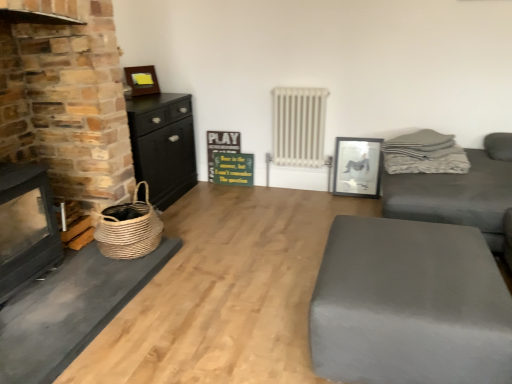
Question: Can we say white metallic radiator at center lies outside gray fabric couch at right?

Choices:
 (A) no
 (B) yes

Answer: (B)

Question: Can you confirm if white metallic radiator at center is taller than gray fabric couch at right?

Choices:
 (A) yes
 (B) no

Answer: (B)

Question: Is white metallic radiator at center shorter than gray fabric couch at right?

Choices:
 (A) no
 (B) yes

Answer: (B)

Question: Would you consider white metallic radiator at center to be distant from gray fabric couch at right?

Choices:
 (A) yes
 (B) no

Answer: (A)

Question: Does white metallic radiator at center have a larger size compared to gray fabric couch at right?

Choices:
 (A) no
 (B) yes

Answer: (A)

Question: Choose the correct answer: Is black glossy picture frame at upper right, the second picture frame from the left, inside green wooden signboard at center or outside it?

Choices:
 (A) outside
 (B) inside

Answer: (A)

Question: Considering their positions, is black glossy picture frame at upper right, arranged as the first picture frame when ordered from the bottom, located in front of or behind green wooden signboard at center?

Choices:
 (A) front
 (B) behind

Answer: (A)

Question: Considering the positions of point (378, 180) and point (208, 132), is point (378, 180) closer or farther from the camera than point (208, 132)?

Choices:
 (A) closer
 (B) farther

Answer: (A)

Question: Is black glossy picture frame at upper right, the second picture frame from the left, wider or thinner than green wooden signboard at center?

Choices:
 (A) wide
 (B) thin

Answer: (A)

Question: From the image's perspective, is matte gray ottoman at lower right above or below green wooden signboard at center?

Choices:
 (A) above
 (B) below

Answer: (B)

Question: Considering the positions of matte gray ottoman at lower right and green wooden signboard at center in the image, is matte gray ottoman at lower right wider or thinner than green wooden signboard at center?

Choices:
 (A) wide
 (B) thin

Answer: (A)

Question: Is matte gray ottoman at lower right in front of or behind green wooden signboard at center in the image?

Choices:
 (A) front
 (B) behind

Answer: (A)

Question: Visually, is matte gray ottoman at lower right positioned to the left or to the right of green wooden signboard at center?

Choices:
 (A) left
 (B) right

Answer: (B)

Question: Is green wooden signboard at center taller or shorter than black wood chest of drawers at left?

Choices:
 (A) tall
 (B) short

Answer: (B)

Question: From the image's perspective, is green wooden signboard at center located above or below black wood chest of drawers at left?

Choices:
 (A) below
 (B) above

Answer: (A)